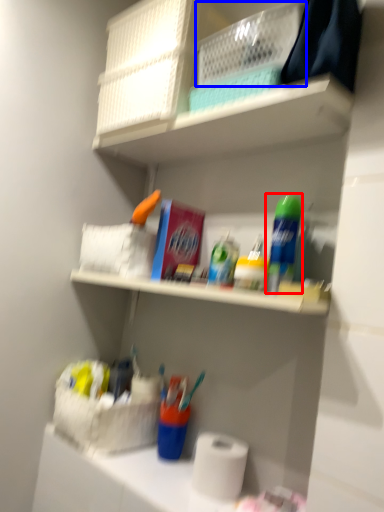
Question: Which point is further to the camera, cleaning product (highlighted by a red box) or basket (highlighted by a blue box)?

Choices:
 (A) cleaning product
 (B) basket

Answer: (A)